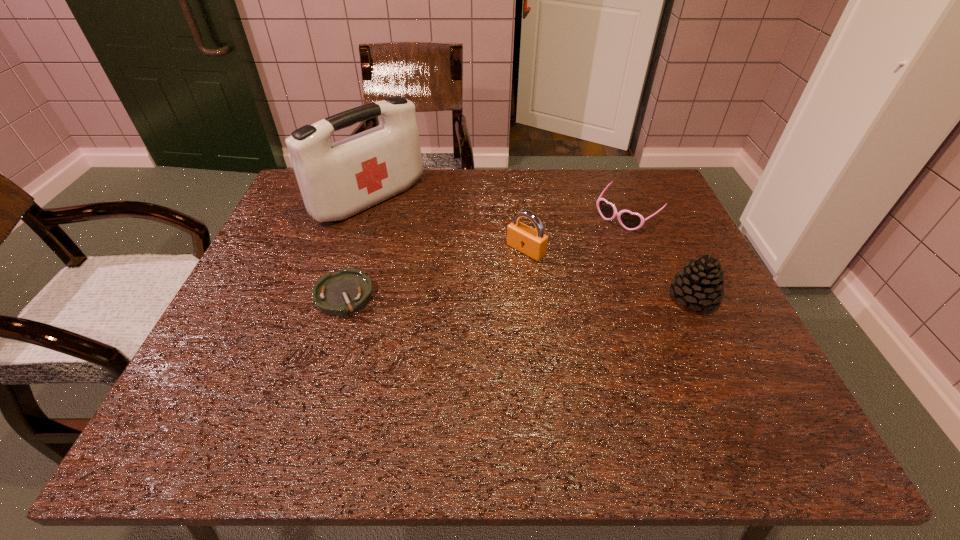
In the image, there is a desktop. Find the location of `vacant space at the far left corner`. vacant space at the far left corner is located at coordinates (293, 199).

The height and width of the screenshot is (540, 960). I want to click on vacant space at the far right corner, so click(x=620, y=176).

You are a GUI agent. You are given a task and a screenshot of the screen. Output one action in this format:
    pyautogui.click(x=<x>, y=<y>)
    Task: Click on the vacant space at the near right corner of the desktop
    The width and height of the screenshot is (960, 540).
    Given the screenshot: What is the action you would take?
    pyautogui.click(x=728, y=371)

Locate an element on the screen. This screenshot has height=540, width=960. vacant region between the shortest object and the pinecone is located at coordinates (518, 296).

Where is `blank region between the third farthest object and the second shortest object`? This screenshot has height=540, width=960. blank region between the third farthest object and the second shortest object is located at coordinates (576, 233).

Locate an element on the screen. free space between the ashtray and the third farthest object is located at coordinates (435, 272).

Identify the location of unoccupied area between the pinecone and the third farthest object. pos(610,274).

Where is `empty space between the shortest object and the first-aid kit`? The height and width of the screenshot is (540, 960). empty space between the shortest object and the first-aid kit is located at coordinates (357, 247).

Identify the location of empty space that is in between the tallest object and the sunglasses. (498, 208).

At what (x,y) coordinates should I click in order to perform the action: click on free point between the pinecone and the third farthest object. Please return your answer as a coordinate pair (x, y). This screenshot has width=960, height=540. Looking at the image, I should click on (610, 274).